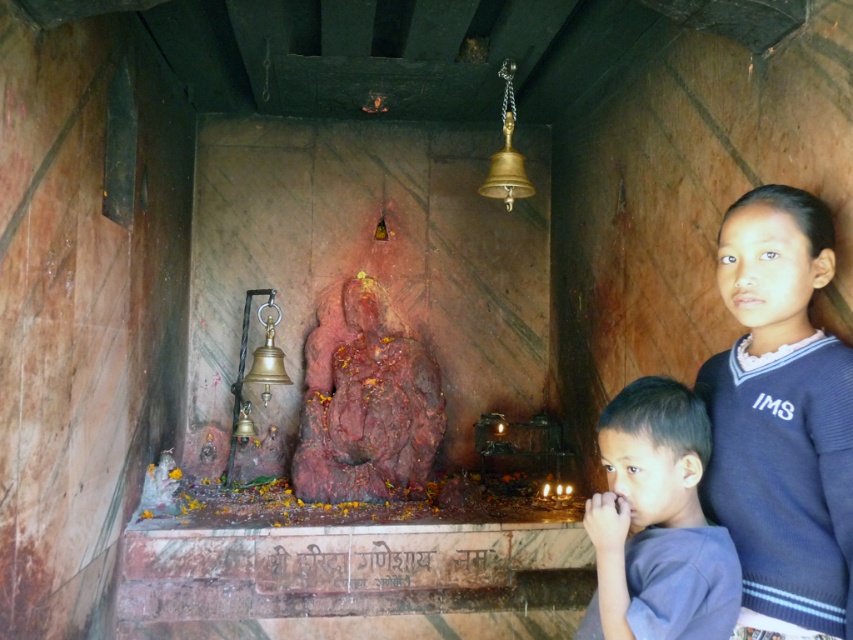
You are organizing a charity clothing drive and need to determine which items can fit into a donation box that has a maximum capacity of 1.2 cubic feet. The blue knitted sweater at right and the gray cotton shirt at lower right are both candidates. Based on their sizes, which one is more likely to fit into the box?

The gray cotton shirt at lower right is smaller in size compared to the blue knitted sweater at right, so it is more likely to fit into the donation box with a 1.2 cubic feet capacity.

You are visiting the shrine and want to place a new offering on the altar. You have a blue knitted sweater at right and a gray cotton shirt at lower right. Which item is placed higher up on the altar?

Answer: The blue knitted sweater at right is positioned over gray cotton shirt at lower right, so it is placed higher up on the altar.

You are standing in front of the shrine and want to place a new offering. The blue knitted sweater at right is currently located at coordinates point 0.655, 0.917. If you want to place your offering closer to the center of the shrine, should you move the sweater towards the left or right?

The blue knitted sweater at right is located at point [781,419]. To move it closer to the center of the shrine, you should move it to the left.